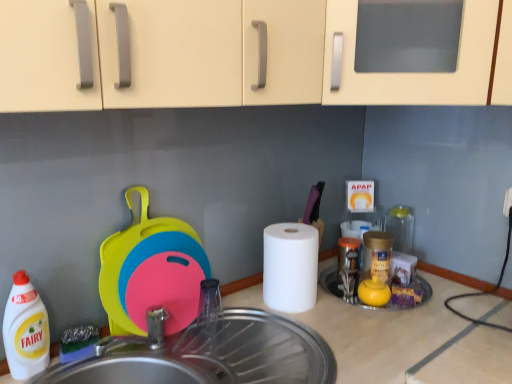
Question: Does rubberized plastic cutting boards at left have a greater height compared to white matte paper towel at center?

Choices:
 (A) yes
 (B) no

Answer: (A)

Question: Is the position of rubberized plastic cutting boards at left more distant than that of white matte paper towel at center?

Choices:
 (A) yes
 (B) no

Answer: (B)

Question: From a real-world perspective, is rubberized plastic cutting boards at left located higher than white matte paper towel at center?

Choices:
 (A) yes
 (B) no

Answer: (A)

Question: From a real-world perspective, is rubberized plastic cutting boards at left positioned under white matte paper towel at center based on gravity?

Choices:
 (A) no
 (B) yes

Answer: (A)

Question: Is rubberized plastic cutting boards at left facing away from white matte paper towel at center?

Choices:
 (A) yes
 (B) no

Answer: (B)

Question: Is metallic stainless steel sink at lower center situated inside white matte paper towel at center or outside?

Choices:
 (A) outside
 (B) inside

Answer: (A)

Question: Based on their positions, is metallic stainless steel sink at lower center located to the left or right of white matte paper towel at center?

Choices:
 (A) left
 (B) right

Answer: (A)

Question: Is metallic stainless steel sink at lower center in front of or behind white matte paper towel at center in the image?

Choices:
 (A) behind
 (B) front

Answer: (B)

Question: From a real-world perspective, is metallic stainless steel sink at lower center physically located above or below white matte paper towel at center?

Choices:
 (A) below
 (B) above

Answer: (A)

Question: Looking at their shapes, would you say white plastic bottle at left is wider or thinner than white matte paper towel at center?

Choices:
 (A) thin
 (B) wide

Answer: (A)

Question: From the image's perspective, is white plastic bottle at left positioned above or below white matte paper towel at center?

Choices:
 (A) above
 (B) below

Answer: (B)

Question: Looking at the image, does white plastic bottle at left seem bigger or smaller compared to white matte paper towel at center?

Choices:
 (A) small
 (B) big

Answer: (A)

Question: Is point (14, 311) closer or farther from the camera than point (287, 231)?

Choices:
 (A) closer
 (B) farther

Answer: (A)

Question: In the image, is white matte paper towel at center positioned in front of or behind metallic stainless steel sink at lower center?

Choices:
 (A) front
 (B) behind

Answer: (B)

Question: From a real-world perspective, relative to metallic stainless steel sink at lower center, is white matte paper towel at center vertically above or below?

Choices:
 (A) above
 (B) below

Answer: (A)